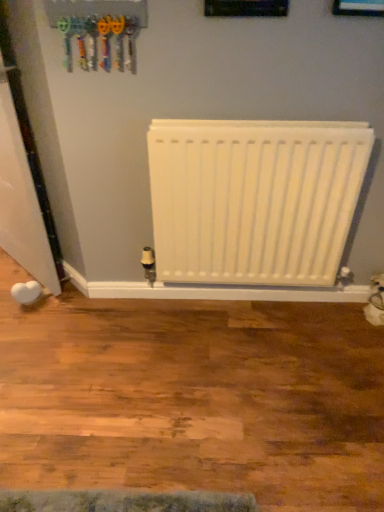
Question: In the image, is white glossy door at left positioned in front of or behind white matte radiator at center?

Choices:
 (A) front
 (B) behind

Answer: (A)

Question: In terms of height, does white glossy door at left look taller or shorter compared to white matte radiator at center?

Choices:
 (A) tall
 (B) short

Answer: (A)

Question: Based on their relative distances, which object is farther from the blue glossy picture frame at upper center?

Choices:
 (A) plastic toy keys at upper left
 (B) white glossy door at left
 (C) white matte radiator at center

Answer: (B)

Question: Which is nearer to the white glossy door at left?

Choices:
 (A) white matte radiator at center
 (B) plastic toy keys at upper left
 (C) blue glossy picture frame at upper center

Answer: (B)